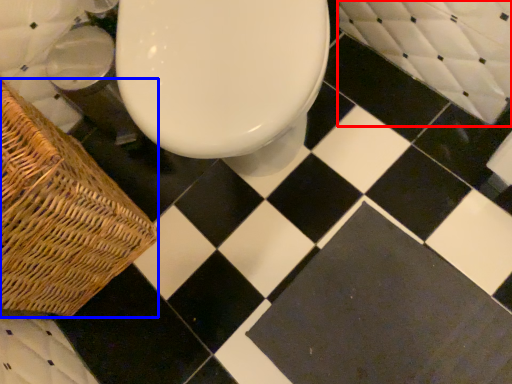
Question: Among these objects, which one is farthest to the camera, bath (highlighted by a red box) or picnic basket (highlighted by a blue box)?

Choices:
 (A) bath
 (B) picnic basket

Answer: (A)